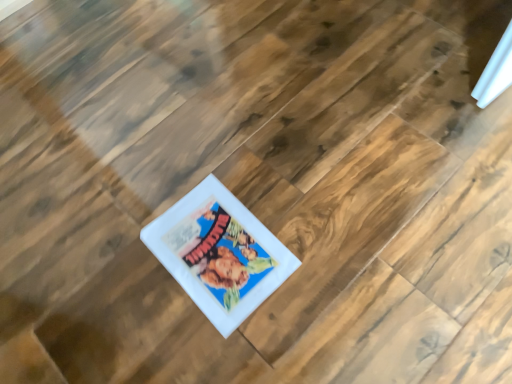
Identify the location of free space to the right of white plastic picture frame at center. (309, 210).